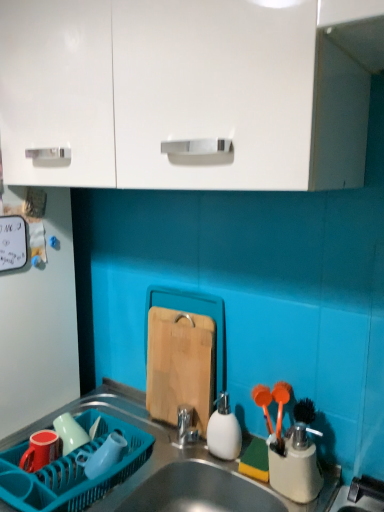
You are a GUI agent. You are given a task and a screenshot of the screen. Output one action in this format:
    pyautogui.click(x=<x>, y=<y>)
    Task: Click on the free space on the front side of matte green cup at left, which is the third tableware in right-to-left order
    
    Given the screenshot: What is the action you would take?
    pyautogui.click(x=61, y=482)